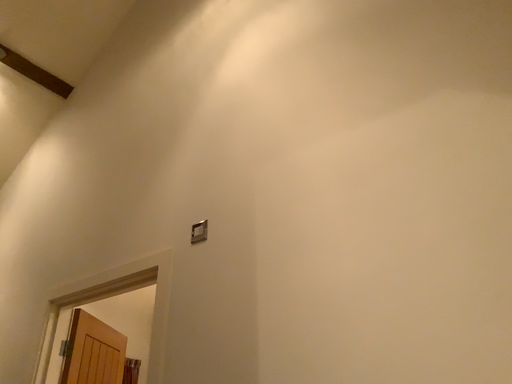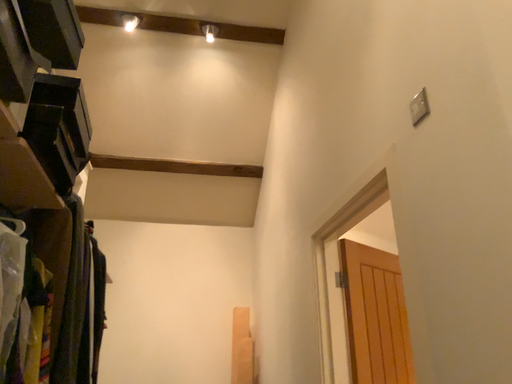
Question: How did the camera likely rotate when shooting the video?

Choices:
 (A) rotated downward
 (B) rotated upward

Answer: (A)